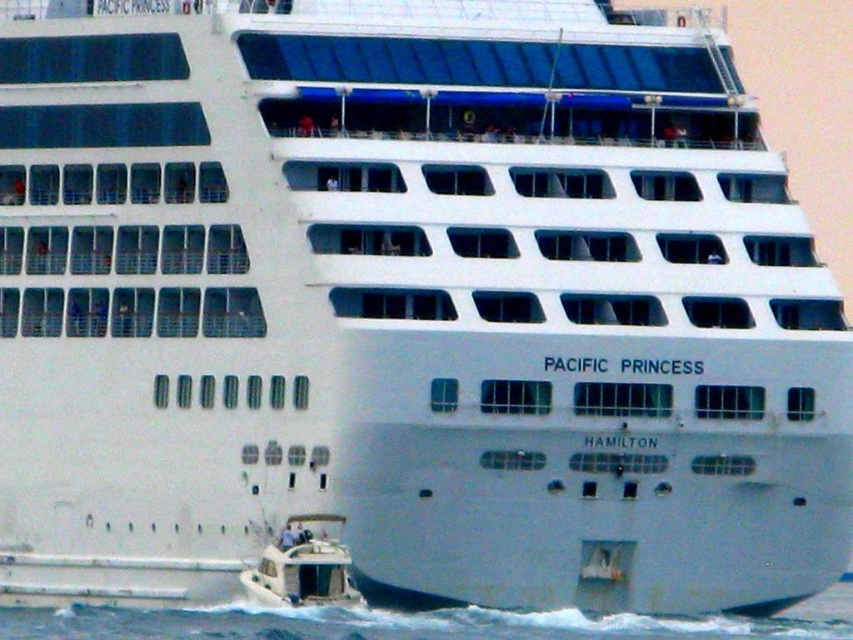
Question: Which point is farther to the camera?

Choices:
 (A) (277, 579)
 (B) (840, 616)

Answer: (B)

Question: Does blue water at lower left appear over white glossy motorboat at lower left?

Choices:
 (A) yes
 (B) no

Answer: (B)

Question: Which point is closer to the camera?

Choices:
 (A) white glossy motorboat at lower left
 (B) blue water at lower left

Answer: (B)

Question: Can you confirm if blue water at lower left is positioned below white glossy motorboat at lower left?

Choices:
 (A) no
 (B) yes

Answer: (B)

Question: Is blue water at lower left further to camera compared to white glossy motorboat at lower left?

Choices:
 (A) no
 (B) yes

Answer: (A)